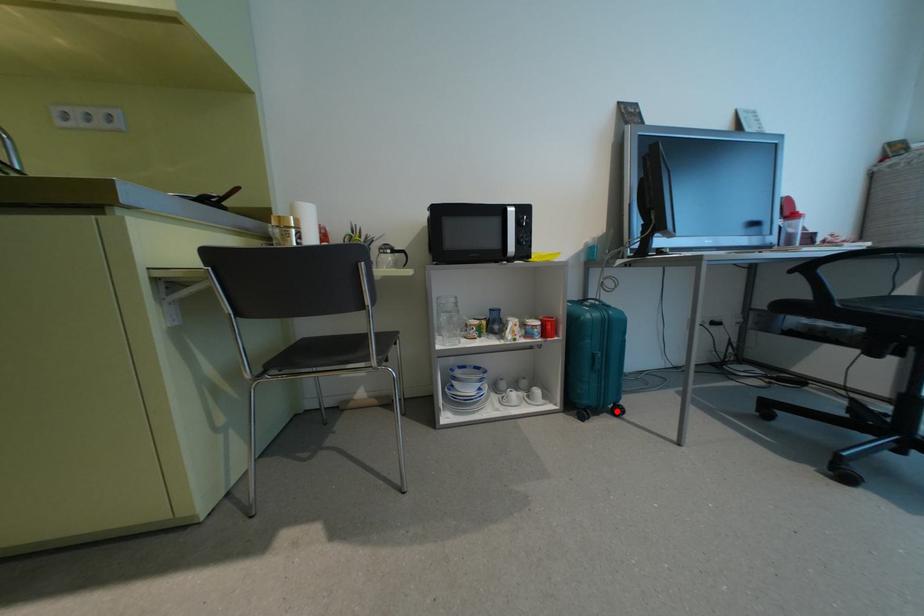
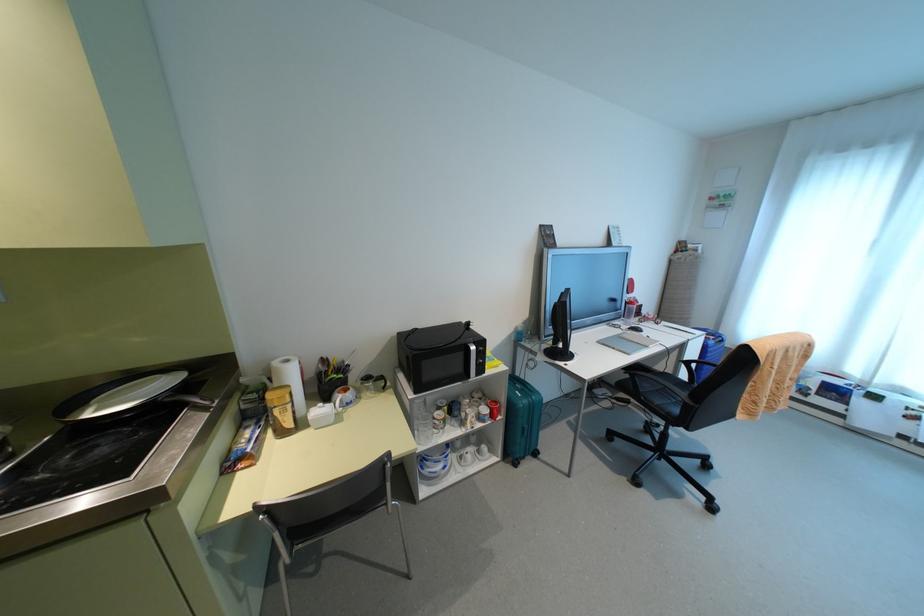
Question: I am providing you with two images of the same scene from different viewpoints. A red point is marked on the first image. At the location where the point appears in image 1, is it still visible in image 2?

Choices:
 (A) Yes
 (B) No

Answer: (A)